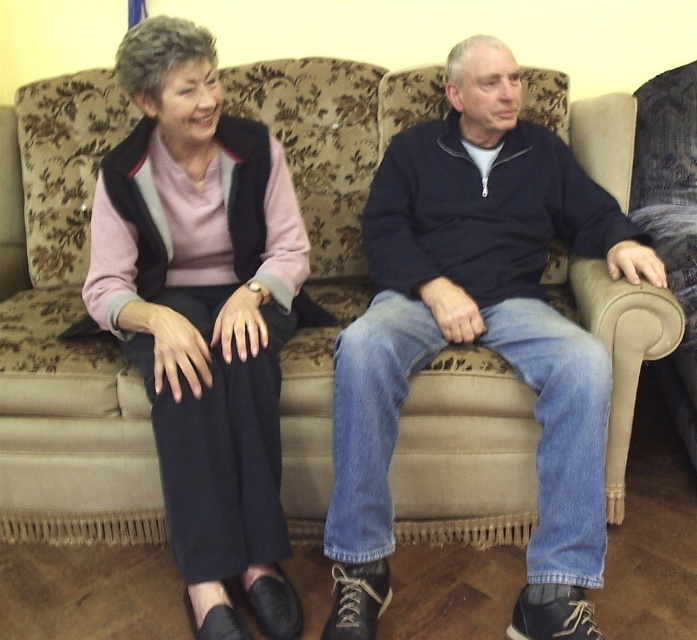
Which is below, denim jeans at center or matte black pants at left?

matte black pants at left is below.

Where is `denim jeans at center`? denim jeans at center is located at coordinates (477, 333).